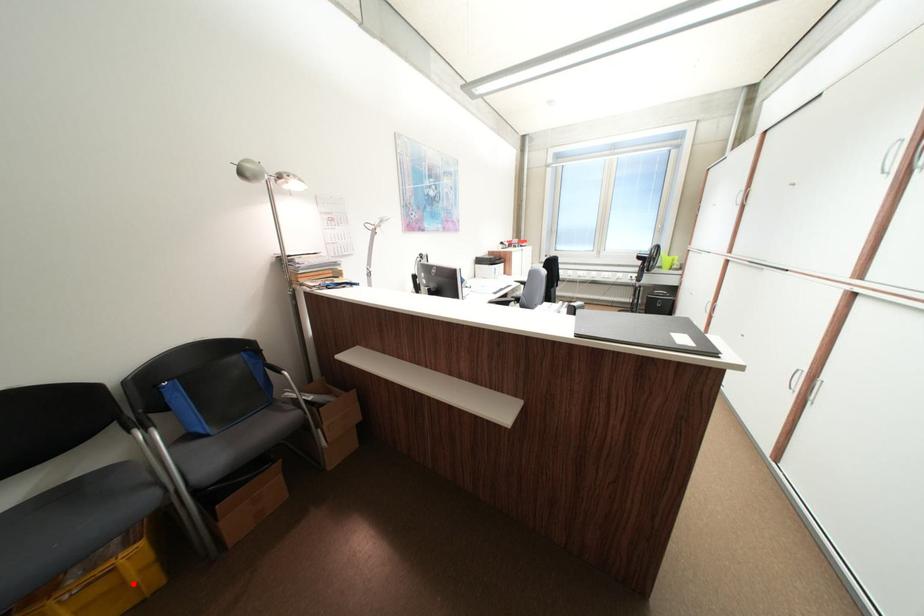
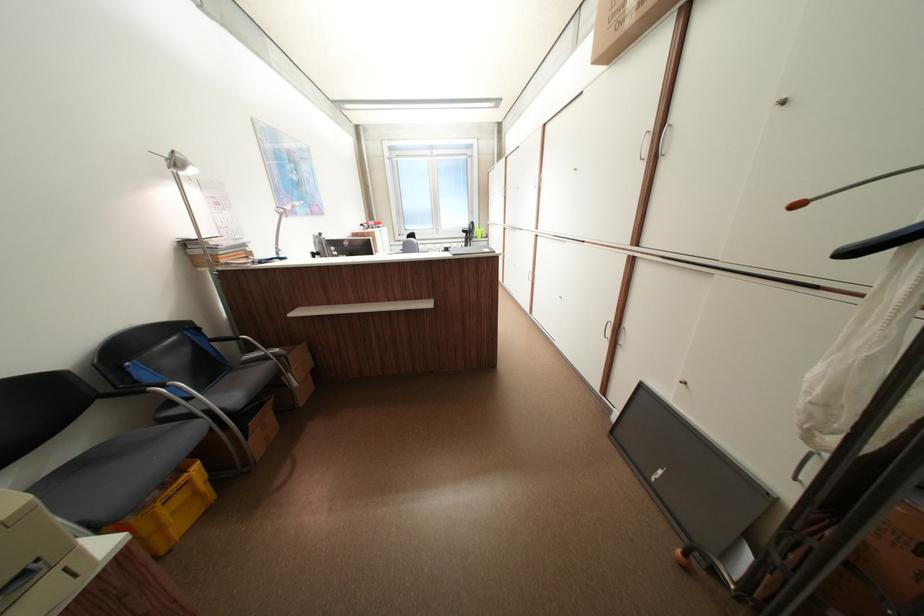
Question: A red point is marked in image1. In image2, is the corresponding 3D point closer to the camera or farther? Reply with the corresponding letter.

Choices:
 (A) The corresponding 3D point is closer.
 (B) The corresponding 3D point is farther.

Answer: (B)